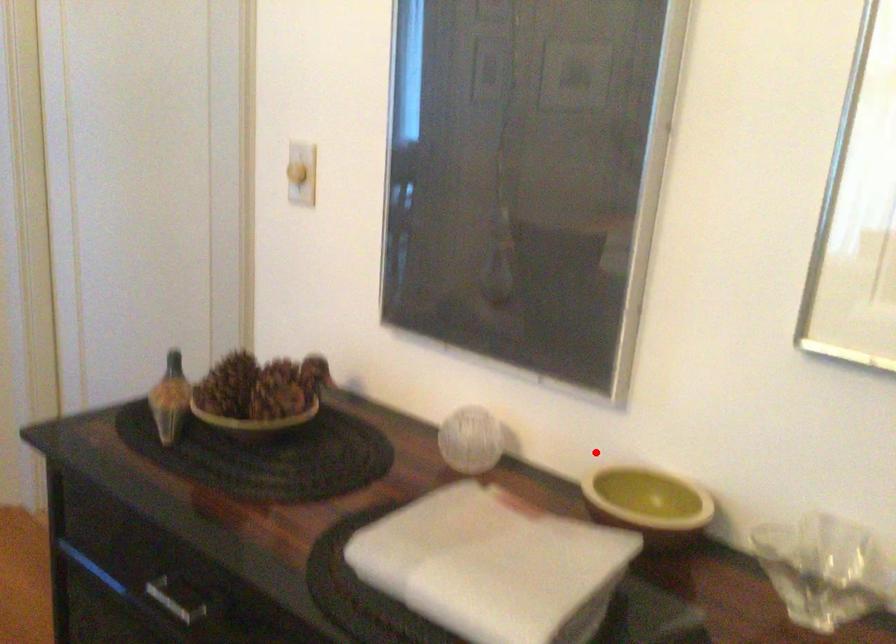
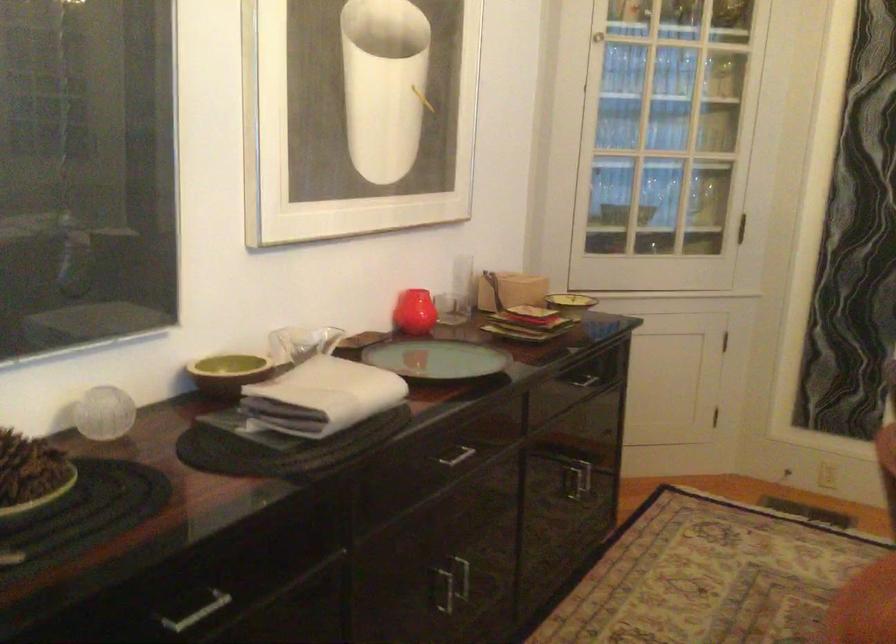
Question: I am providing you with two images of the same scene from different viewpoints. In image1, a red point is highlighted. Considering the same 3D point in image2, which of the following is correct?

Choices:
 (A) It is closer
 (B) It is farther

Answer: (B)